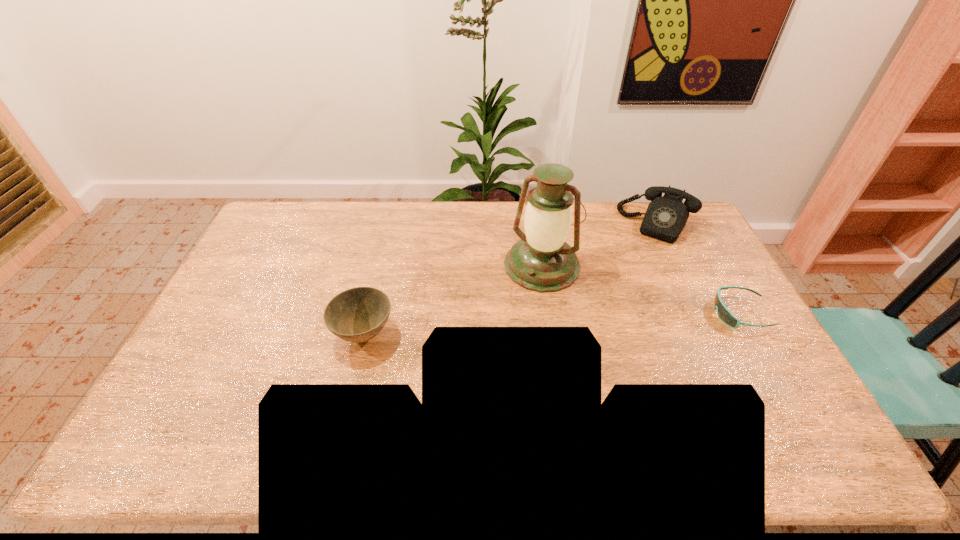
Where is `vacant region located 0.140m on the dial of the telephone`? Image resolution: width=960 pixels, height=540 pixels. vacant region located 0.140m on the dial of the telephone is located at coordinates (636, 265).

Image resolution: width=960 pixels, height=540 pixels. I want to click on blank area located 0.350m on the dial of the telephone, so click(615, 304).

Where is `free space located 0.140m on the dial of the telephone`? free space located 0.140m on the dial of the telephone is located at coordinates click(636, 265).

At what (x,y) coordinates should I click in order to perform the action: click on blank space located with the light compartment facing forward on the third object from right to left. Please return your answer as a coordinate pair (x, y). Looking at the image, I should click on (476, 361).

In order to click on vacant space positioned with the light compartment facing forward on the third object from right to left in this screenshot , I will do `click(468, 375)`.

You are a GUI agent. You are given a task and a screenshot of the screen. Output one action in this format:
    pyautogui.click(x=<x>, y=<y>)
    Task: Click on the free space located with the light compartment facing forward on the third object from right to left
    
    Given the screenshot: What is the action you would take?
    pyautogui.click(x=517, y=301)

You are a GUI agent. You are given a task and a screenshot of the screen. Output one action in this format:
    pyautogui.click(x=<x>, y=<y>)
    Task: Click on the object present at the far edge
    
    Given the screenshot: What is the action you would take?
    pyautogui.click(x=666, y=216)

Locate an element on the screen. This screenshot has width=960, height=540. sunglasses that is at the right edge is located at coordinates (725, 315).

Find the location of a particular element. Image resolution: width=960 pixels, height=540 pixels. telephone situated at the right edge is located at coordinates tap(666, 216).

Find the location of a particular element. Image resolution: width=960 pixels, height=540 pixels. object positioned at the far right corner is located at coordinates (666, 216).